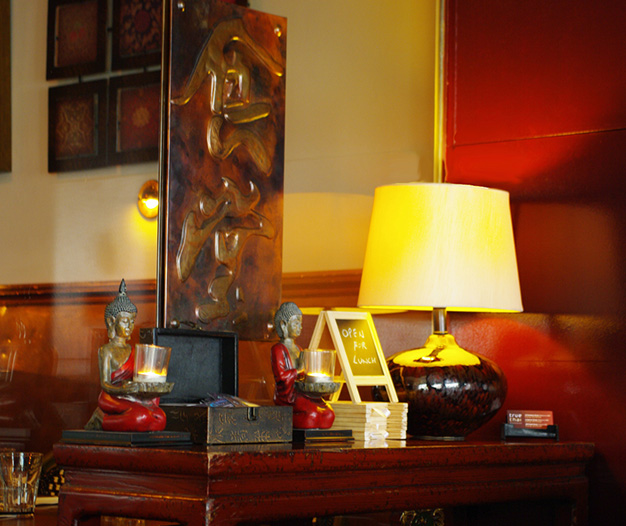
Where is `light source`? This screenshot has height=526, width=626. light source is located at coordinates (448, 261), (151, 205).